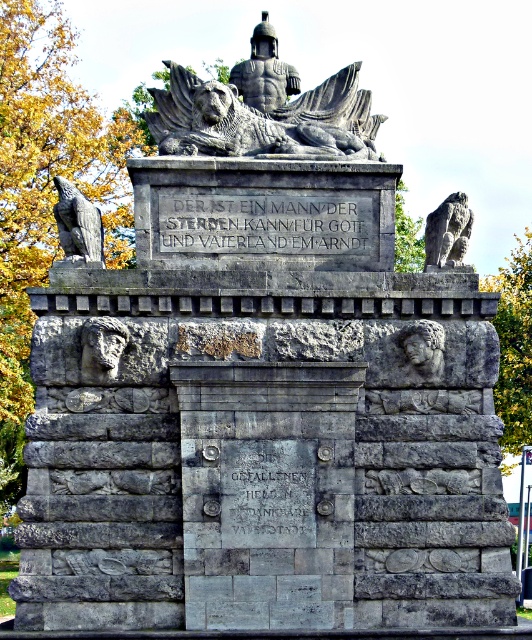
Question: From the image, what is the correct spatial relationship of dark gray stone lion at upper center in relation to gray stone inscription at center?

Choices:
 (A) below
 (B) above

Answer: (B)

Question: Which object appears closest to the camera in this image?

Choices:
 (A) stone inscription at center
 (B) dark gray stone lion at upper center
 (C) gray stone inscription at center
 (D) gray stone eagle at upper left

Answer: (A)

Question: Does dark gray stone lion at upper center appear over gray stone eagle at upper right?

Choices:
 (A) no
 (B) yes

Answer: (B)

Question: Which point is farther from the camera taking this photo?

Choices:
 (A) (192, 248)
 (B) (376, 154)
 (C) (431, 220)

Answer: (B)

Question: Does stone inscription at center have a smaller size compared to gray stone eagle at upper left?

Choices:
 (A) no
 (B) yes

Answer: (B)

Question: Considering the real-world distances, which object is closest to the gray stone eagle at upper right?

Choices:
 (A) gray stone eagle at upper left
 (B) gray stone inscription at center

Answer: (A)